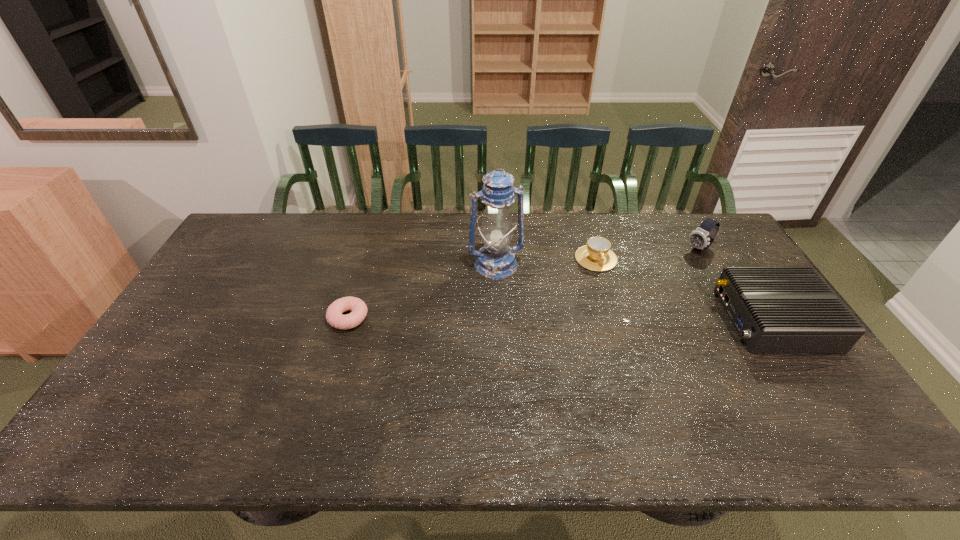
Choose which object is the second nearest neighbor to the second object from left to right. Please provide its 2D coordinates. Your answer should be formatted as a tuple, i.e. [(x, y)], where the tuple contains the x and y coordinates of a point satisfying the conditions above.

[(334, 316)]

Locate an element on the screen. This screenshot has width=960, height=540. object that is the fourth nearest to the second shortest object is located at coordinates click(334, 316).

This screenshot has width=960, height=540. I want to click on free spot that satisfies the following two spatial constraints: 1. on the back side of the second tallest object; 2. on the right side of the cup, so point(593,249).

You are a GUI agent. You are given a task and a screenshot of the screen. Output one action in this format:
    pyautogui.click(x=<x>, y=<y>)
    Task: Click on the vacant space that satisfies the following two spatial constraints: 1. on the back side of the watch; 2. on the left side of the lantern
    
    Given the screenshot: What is the action you would take?
    pyautogui.click(x=495, y=249)

I want to click on vacant position in the image that satisfies the following two spatial constraints: 1. on the front side of the third tallest object; 2. on the back panel of the leftmost object, so click(348, 320).

Where is `vacant area in the image that satisfies the following two spatial constraints: 1. on the back side of the cup; 2. on the left side of the second tallest object`? The width and height of the screenshot is (960, 540). vacant area in the image that satisfies the following two spatial constraints: 1. on the back side of the cup; 2. on the left side of the second tallest object is located at coordinates (593, 249).

Find the location of a particular element. The image size is (960, 540). free space that satisfies the following two spatial constraints: 1. on the front side of the tallest object; 2. on the back panel of the third tallest object is located at coordinates (498, 320).

What are the coordinates of `vacant region that satisfies the following two spatial constraints: 1. on the back side of the watch; 2. on the right side of the cup` in the screenshot? It's located at (593, 249).

The width and height of the screenshot is (960, 540). I want to click on vacant point that satisfies the following two spatial constraints: 1. on the back side of the leftmost object; 2. on the left side of the lantern, so click(x=364, y=265).